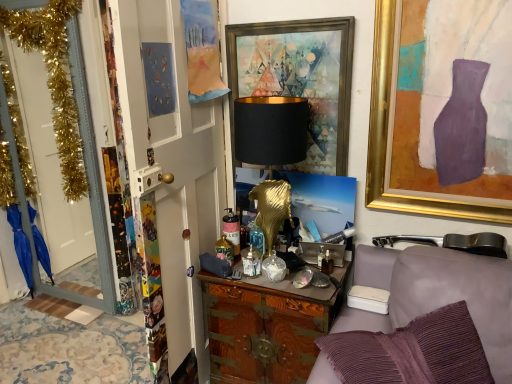
Find the location of `empty space that is ontop of metallic gold picture frame at upper center, arranged as the second picture frame when viewed from the right (from a real-world perspective)`. empty space that is ontop of metallic gold picture frame at upper center, arranged as the second picture frame when viewed from the right (from a real-world perspective) is located at coordinates (285, 15).